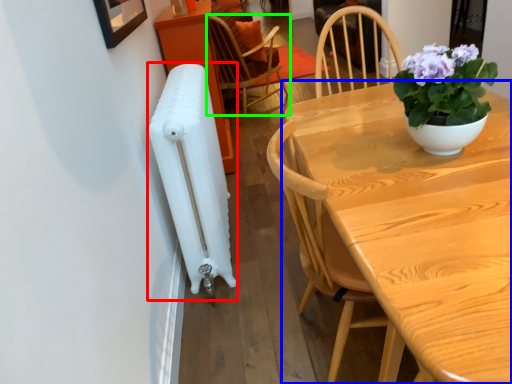
Question: Which object is positioned farthest from radiator (highlighted by a red box)? Select from table (highlighted by a blue box) and chair (highlighted by a green box).

Choices:
 (A) table
 (B) chair

Answer: (B)